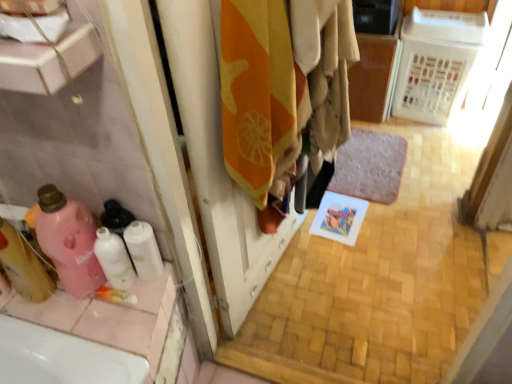
The image size is (512, 384). Identify the location of vacant region above gray plush bath mat at center (from a real-world perspective). (371, 170).